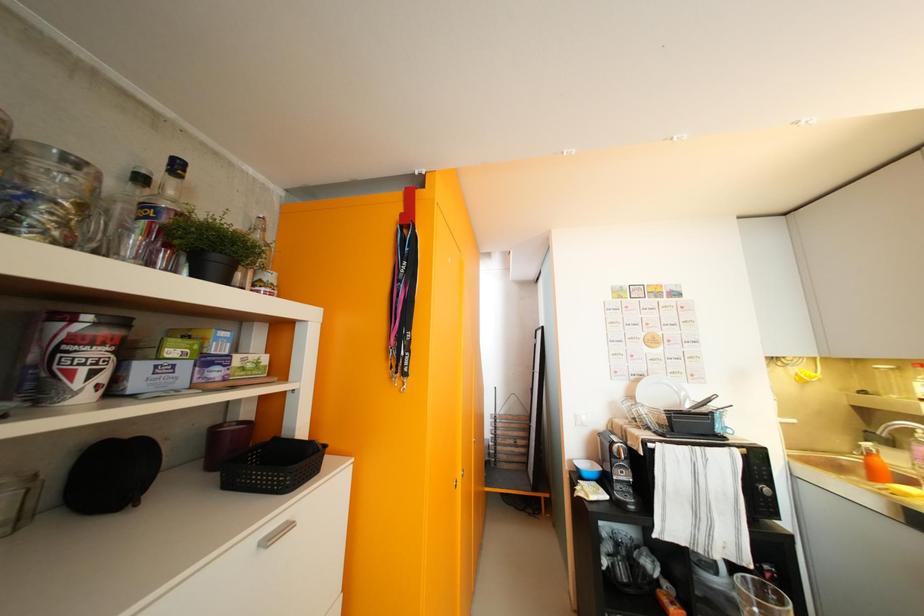
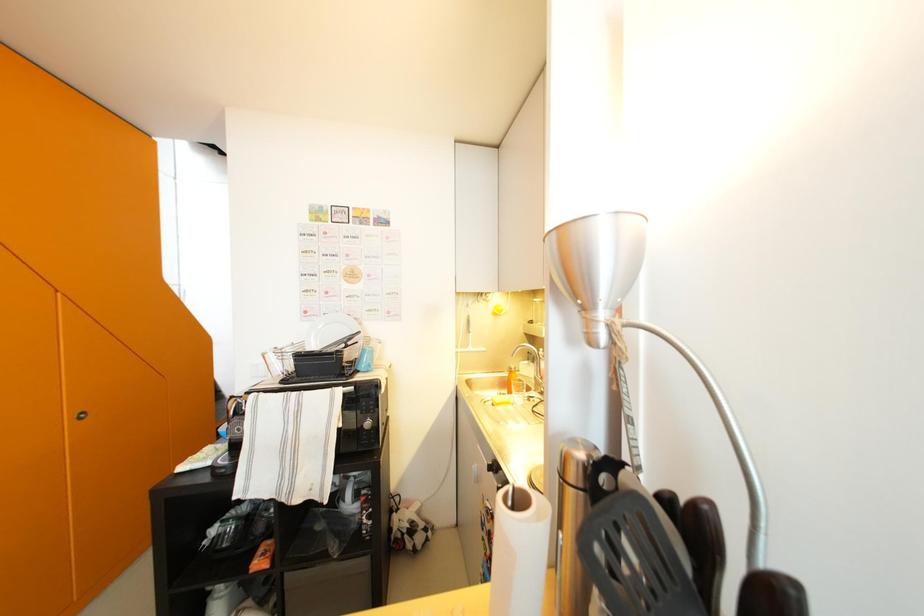
Question: What movement of the cameraman would produce the second image?

Choices:
 (A) Left
 (B) Right
 (C) Forward
 (D) Backward

Answer: (B)